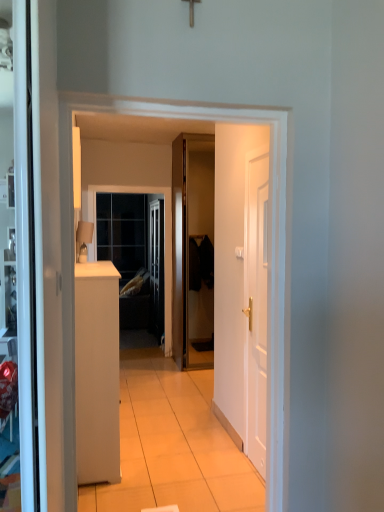
Question: Would you say glossy wood door at center, marked as the 1th door in a left-to-right arrangement, is inside or outside clear glass window at center?

Choices:
 (A) outside
 (B) inside

Answer: (A)

Question: Considering the positions of glossy wood door at center, marked as the 1th door in a left-to-right arrangement, and clear glass window at center in the image, is glossy wood door at center, marked as the 1th door in a left-to-right arrangement, wider or thinner than clear glass window at center?

Choices:
 (A) wide
 (B) thin

Answer: (A)

Question: Estimate the real-world distances between objects in this image. Which object is closer to the white matte door at right, marked as the 1th door in a front-to-back arrangement?

Choices:
 (A) white matte cabinet at left
 (B) clear glass window at center
 (C) glossy wood door at center, placed as the first door when sorted from back to front
 (D) matte beige lampshade at left

Answer: (A)

Question: Considering the real-world distances, which object is closest to the matte beige lampshade at left?

Choices:
 (A) white matte cabinet at left
 (B) clear glass window at center
 (C) white matte door at right, which appears as the second door when viewed from the left
 (D) glossy wood door at center, placed as the first door when sorted from back to front

Answer: (A)